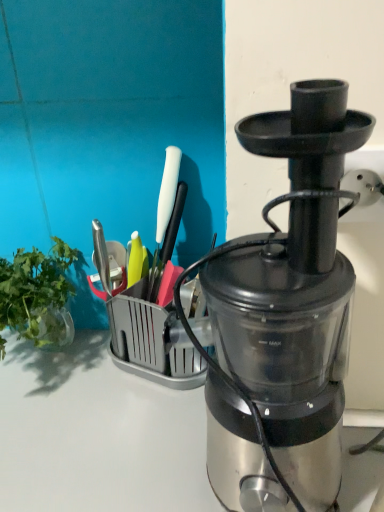
Locate an element on the screen. This screenshot has width=384, height=512. green leafy vegetable at left is located at coordinates (34, 287).

What do you see at coordinates (34, 287) in the screenshot? I see `green leafy vegetable at left` at bounding box center [34, 287].

Measure the distance between point (265, 265) and camera.

Point (265, 265) and camera are 14.21 inches apart from each other.

Describe the element at coordinates (282, 318) in the screenshot. I see `metallic silver blender at center` at that location.

Locate an element on the screen. The height and width of the screenshot is (512, 384). metallic silver blender at center is located at coordinates (282, 318).

In order to click on green leafy vegetable at left in this screenshot , I will do `click(34, 287)`.

Is metallic silver blender at center at the right side of green leafy vegetable at left?

Yes.

Is metallic silver blender at center further to the viewer compared to green leafy vegetable at left?

No, it is in front of green leafy vegetable at left.

Between point (317, 128) and point (62, 273), which one is positioned in front?

Positioned in front is point (317, 128).

From the image's perspective, between metallic silver blender at center and green leafy vegetable at left, who is located below?

green leafy vegetable at left, from the image's perspective.

From a real-world perspective, is metallic silver blender at center positioned over green leafy vegetable at left based on gravity?

Correct, in the physical world, metallic silver blender at center is higher than green leafy vegetable at left.

Can you confirm if metallic silver blender at center is thinner than green leafy vegetable at left?

Yes.

Looking at this image, between metallic silver blender at center and green leafy vegetable at left, which one has less height?

green leafy vegetable at left is shorter.

Considering the sizes of objects metallic silver blender at center and green leafy vegetable at left in the image provided, who is bigger, metallic silver blender at center or green leafy vegetable at left?

With larger size is metallic silver blender at center.

Looking at this image, choose the correct answer: Is metallic silver blender at center inside green leafy vegetable at left or outside it?

metallic silver blender at center lies outside green leafy vegetable at left.

Would you consider metallic silver blender at center to be distant from green leafy vegetable at left?

No, there isn't a large distance between metallic silver blender at center and green leafy vegetable at left.

Could you tell me if metallic silver blender at center is turned towards green leafy vegetable at left?

No, metallic silver blender at center is not oriented towards green leafy vegetable at left.

How many degrees apart are the facing directions of metallic silver blender at center and green leafy vegetable at left?

The facing directions of metallic silver blender at center and green leafy vegetable at left are 0.528 degrees apart.

The width and height of the screenshot is (384, 512). What are the coordinates of `blender above the green leafy vegetable at left (from a real-world perspective)` in the screenshot? It's located at (282, 318).

Is green leafy vegetable at left to the left or to the right of metallic silver blender at center in the image?

Clearly, green leafy vegetable at left is on the left of metallic silver blender at center in the image.

Does green leafy vegetable at left come behind metallic silver blender at center?

That is True.

Which point is more distant from viewer, (4, 311) or (328, 188)?

The point (4, 311) is farther.

Based on the photo, from the image's perspective, would you say green leafy vegetable at left is shown under metallic silver blender at center?

Yes.

From a real-world perspective, is green leafy vegetable at left located higher than metallic silver blender at center?

Incorrect, from a real-world perspective, green leafy vegetable at left is lower than metallic silver blender at center.

Considering the sizes of objects green leafy vegetable at left and metallic silver blender at center in the image provided, who is thinner, green leafy vegetable at left or metallic silver blender at center?

With smaller width is metallic silver blender at center.

Is green leafy vegetable at left taller or shorter than metallic silver blender at center?

Considering their sizes, green leafy vegetable at left has less height than metallic silver blender at center.

Who is bigger, green leafy vegetable at left or metallic silver blender at center?

metallic silver blender at center is bigger.

Is green leafy vegetable at left not inside metallic silver blender at center?

Yes, green leafy vegetable at left is outside of metallic silver blender at center.

Are green leafy vegetable at left and metallic silver blender at center located far from each other?

They are positioned close to each other.

Could you tell me if green leafy vegetable at left is facing metallic silver blender at center?

No, green leafy vegetable at left is not facing towards metallic silver blender at center.

You are a GUI agent. You are given a task and a screenshot of the screen. Output one action in this format:
    pyautogui.click(x=<x>, y=<y>)
    Task: Click on the blender above the green leafy vegetable at left (from the image's perspective)
    
    Given the screenshot: What is the action you would take?
    pyautogui.click(x=282, y=318)

Where is `vegetable lying on the left of metallic silver blender at center`? Image resolution: width=384 pixels, height=512 pixels. vegetable lying on the left of metallic silver blender at center is located at coordinates (34, 287).

Find the location of a particular element. The width and height of the screenshot is (384, 512). vegetable below the metallic silver blender at center (from the image's perspective) is located at coordinates (34, 287).